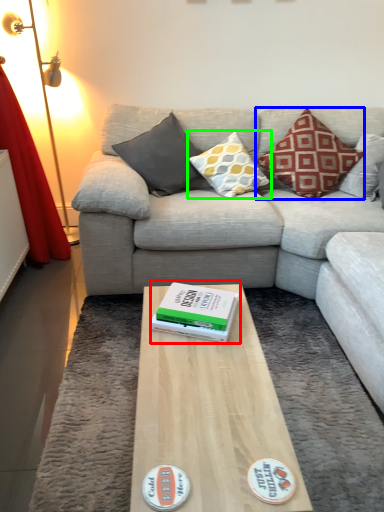
Question: Which object is positioned closest to paperback book (highlighted by a red box)? Select from pillow (highlighted by a blue box) and pillow (highlighted by a green box).

Choices:
 (A) pillow
 (B) pillow

Answer: (B)